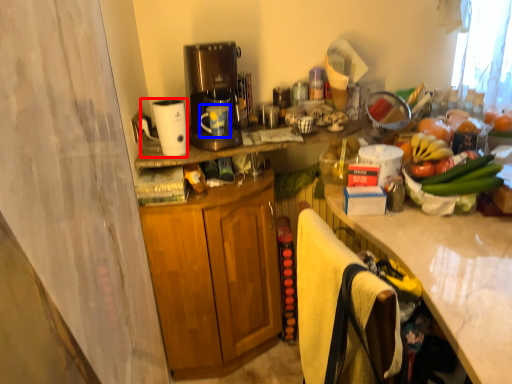
Question: Which object appears closest to the camera in this image, appliance (highlighted by a red box) or mug (highlighted by a blue box)?

Choices:
 (A) appliance
 (B) mug

Answer: (A)